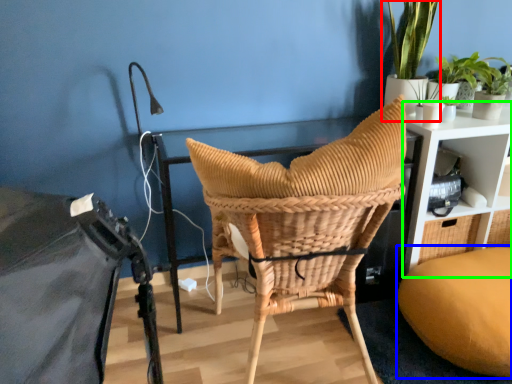
Question: Which object is positioned farthest from houseplant (highlighted by a red box)? Select from bean bag chair (highlighted by a blue box) and shelf (highlighted by a green box).

Choices:
 (A) bean bag chair
 (B) shelf

Answer: (A)